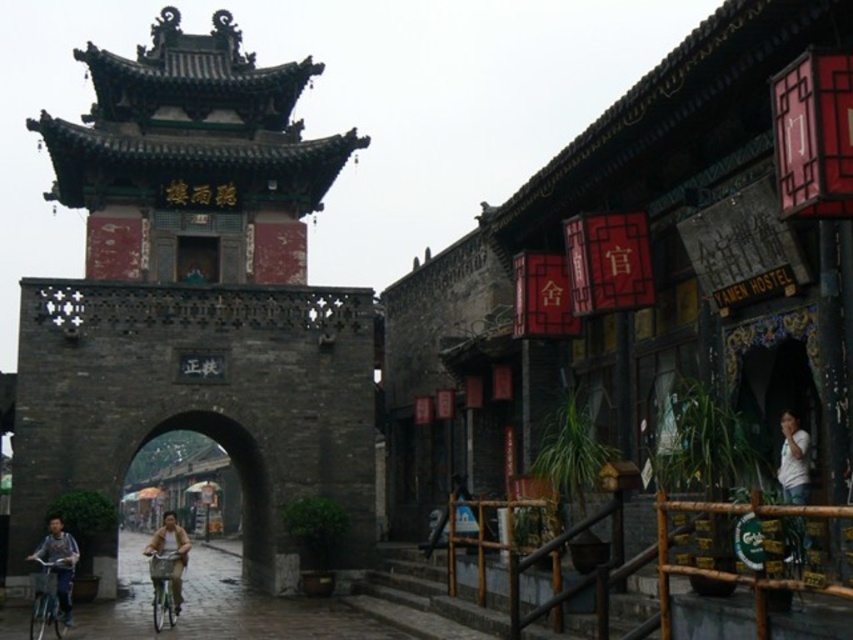
You are a tourist standing in front of the dark gray stone archway at center and the light brown leather jacket at center. Which object is located to the left of the other?

The light brown leather jacket at center is located to the left of the dark gray stone archway at center because the dark gray stone archway at center is positioned on the right side of the light brown leather jacket at center.

You are standing in front of the large stone archway with red banners in the traditional Chinese architectural scene. You notice a white cotton shirt at lower right. Can you estimate its position using a coordinate system where the bottom left corner is the origin point?

The white cotton shirt at lower right is located at the coordinate point of (793, 461) in the 2D space of the image.

You are a tourist standing in front of the dark gray stone archway at center and the light brown leather jacket at center. Which object is closer to you?

The dark gray stone archway at center is closer to you because the light brown leather jacket at center is behind it.